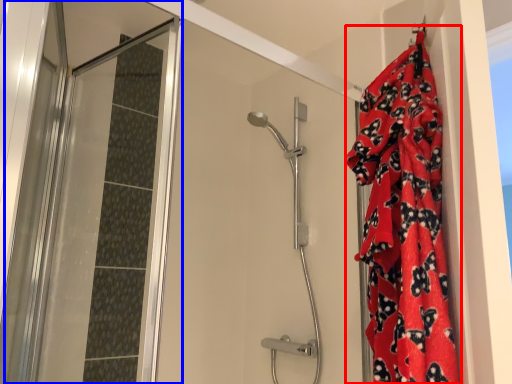
Question: Among these objects, which one is nearest to the camera, blanket (highlighted by a red box) or screen door (highlighted by a blue box)?

Choices:
 (A) blanket
 (B) screen door

Answer: (A)